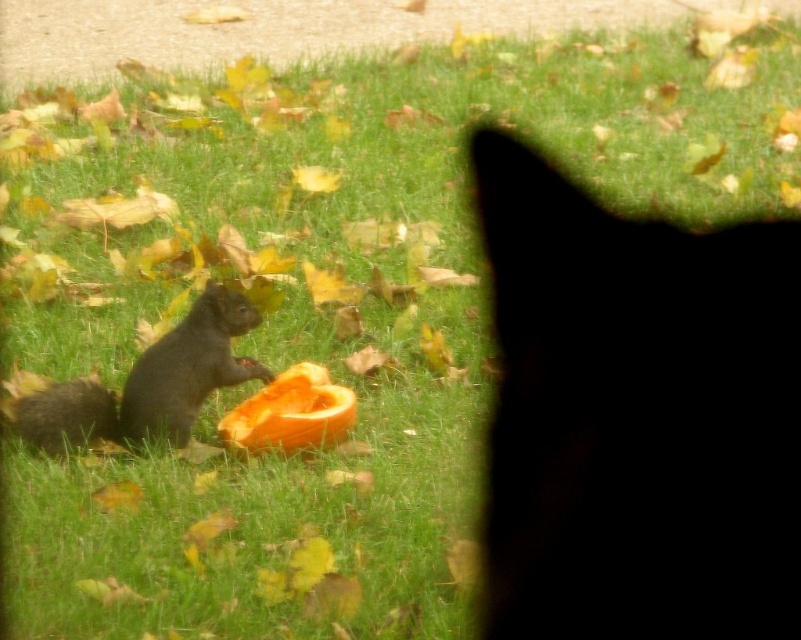
Question: Which point is closer to the camera?

Choices:
 (A) shiny brown squirrel at lower left
 (B) orange matte pumpkin at center
 (C) black matte fur at upper right

Answer: (C)

Question: Is black matte fur at upper right thinner than orange matte pumpkin at center?

Choices:
 (A) yes
 (B) no

Answer: (A)

Question: Is black matte fur at upper right below orange matte pumpkin at center?

Choices:
 (A) no
 (B) yes

Answer: (A)

Question: Which point appears farthest from the camera in this image?

Choices:
 (A) (272, 448)
 (B) (727, 598)
 (C) (79, 381)

Answer: (A)

Question: Which point is closer to the camera?

Choices:
 (A) (714, 576)
 (B) (25, 404)
 (C) (288, 396)

Answer: (A)

Question: Is shiny brown squirrel at lower left closer to camera compared to orange matte pumpkin at center?

Choices:
 (A) yes
 (B) no

Answer: (A)